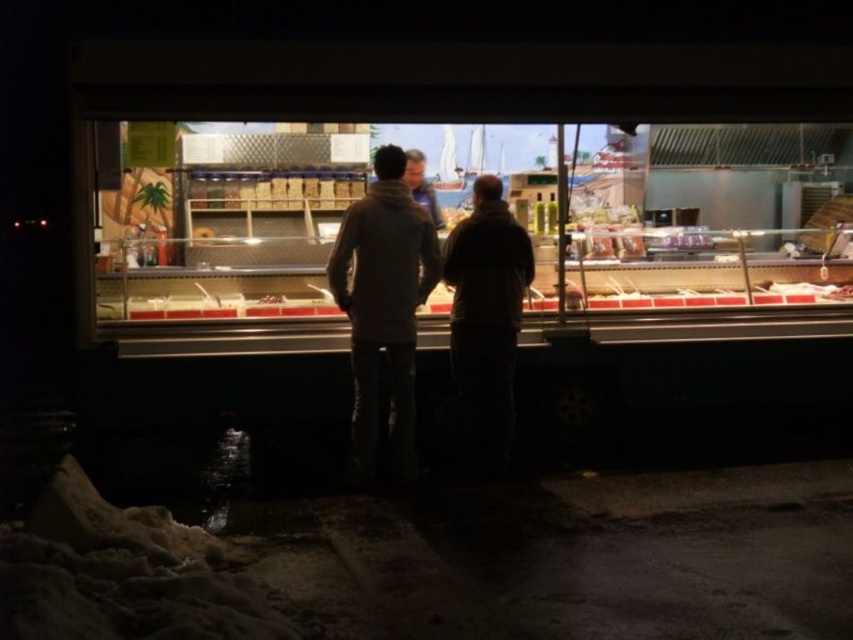
Question: Where is dark gray hoodie at center located in relation to smooth beige jacket at center in the image?

Choices:
 (A) above
 (B) below

Answer: (B)

Question: Can you confirm if dark gray hoodie at center is bigger than smooth beige jacket at center?

Choices:
 (A) yes
 (B) no

Answer: (A)

Question: Estimate the real-world distances between objects in this image. Which object is farther from the transparent glass display case at center?

Choices:
 (A) dark brown leather jacket at center
 (B) dark gray hoodie at center
 (C) smooth beige jacket at center

Answer: (B)

Question: Can you confirm if transparent glass display case at center is thinner than dark brown leather jacket at center?

Choices:
 (A) no
 (B) yes

Answer: (B)

Question: Which point appears closest to the camera in this image?

Choices:
 (A) (465, 225)
 (B) (410, 150)
 (C) (509, 339)

Answer: (C)

Question: Which object is the closest to the transparent glass display case at center?

Choices:
 (A) dark gray hoodie at center
 (B) smooth beige jacket at center

Answer: (B)